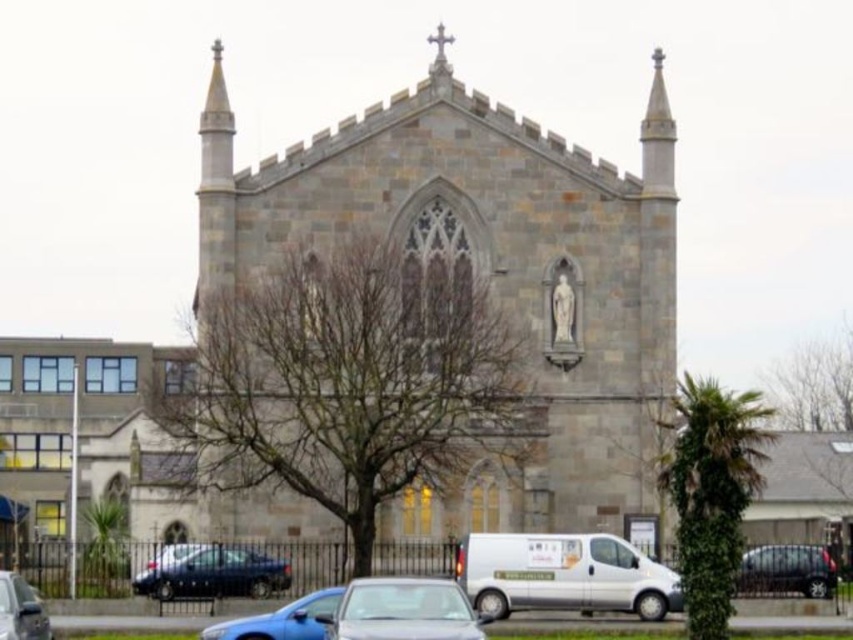
In the scene shown: You are standing in front of the Gothic church and want to park your car. The parking spot you want is located at coordinate point 0.898, 0.661. Is the white metallic van at lower center currently occupying that spot?

The white metallic van at lower center is occupying the parking spot at coordinate point (563,573).

You are a delivery driver who needs to park your truck, which is 2.5 meters wide, in the parking area in front of the church. You see a white metallic van at lower center and a shiny black sedan at lower left. Can you determine if there is enough space between them to park your truck?

The white metallic van at lower center might be wider than the shiny black sedan at lower left. However, without knowing the exact width of the van or the distance between the two vehicles, it is impossible to determine if there is sufficient space for a 2.5 meter wide truck. You should check the actual dimensions before deciding to park.

You are a pedestrian standing in front of the gray stone chapel at center and the blue metallic car at center. Which object is closer to you?

The blue metallic car at center is closer to you because the gray stone chapel at center is positioned over it, indicating that the car is in front of the chapel from your perspective.